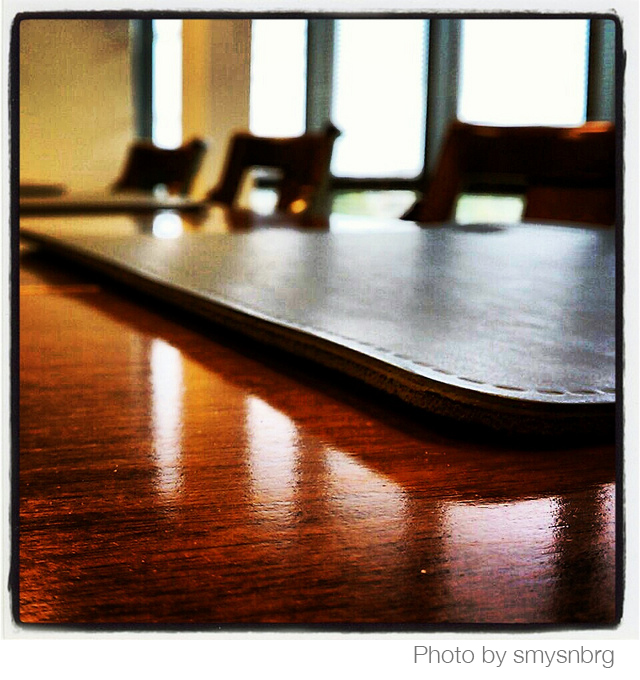
Image resolution: width=640 pixels, height=680 pixels. In order to click on windows in this screenshot , I will do `click(528, 60)`, `click(176, 66)`, `click(273, 65)`.